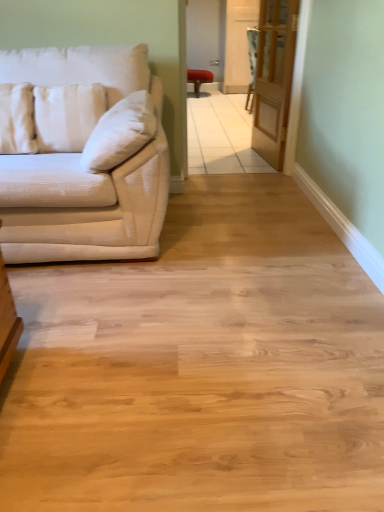
Question: Does velvet-like beige armchair at center have a smaller size compared to white fabric pillow at left, placed as the 1th pillow when sorted from left to right?

Choices:
 (A) no
 (B) yes

Answer: (A)

Question: From a real-world perspective, is velvet-like beige armchair at center beneath white fabric pillow at left, the 2th pillow when ordered from right to left?

Choices:
 (A) no
 (B) yes

Answer: (B)

Question: From a real-world perspective, is velvet-like beige armchair at center on white fabric pillow at left, placed as the 1th pillow when sorted from left to right?

Choices:
 (A) no
 (B) yes

Answer: (A)

Question: From the image's perspective, is velvet-like beige armchair at center located beneath white fabric pillow at left, the 2th pillow when ordered from right to left?

Choices:
 (A) yes
 (B) no

Answer: (B)

Question: Could you tell me if velvet-like beige armchair at center is facing white fabric pillow at left, the 2th pillow when ordered from right to left?

Choices:
 (A) no
 (B) yes

Answer: (A)

Question: From a real-world perspective, is white striped pillow at left, which is the second pillow in left-to-right order, physically located above or below velvet-like beige armchair at center?

Choices:
 (A) below
 (B) above

Answer: (B)

Question: Considering their positions, is white striped pillow at left, the 1th pillow from the right, located in front of or behind velvet-like beige armchair at center?

Choices:
 (A) front
 (B) behind

Answer: (A)

Question: Is white striped pillow at left, the 1th pillow from the right, to the left or to the right of velvet-like beige armchair at center in the image?

Choices:
 (A) right
 (B) left

Answer: (B)

Question: Looking at the image, does white striped pillow at left, which is the second pillow in left-to-right order, seem bigger or smaller compared to velvet-like beige armchair at center?

Choices:
 (A) big
 (B) small

Answer: (B)

Question: Is white fabric pillow at left, placed as the 1th pillow when sorted from left to right, situated inside matte white couch at left or outside?

Choices:
 (A) outside
 (B) inside

Answer: (B)

Question: Is point (13, 119) closer or farther from the camera than point (122, 67)?

Choices:
 (A) farther
 (B) closer

Answer: (B)

Question: From a real-world perspective, is white fabric pillow at left, the 2th pillow when ordered from right to left, physically located above or below matte white couch at left?

Choices:
 (A) above
 (B) below

Answer: (A)

Question: Visually, is white fabric pillow at left, the 2th pillow when ordered from right to left, positioned to the left or to the right of matte white couch at left?

Choices:
 (A) right
 (B) left

Answer: (B)

Question: Is matte red stool at center in front of or behind velvet-like beige armchair at center in the image?

Choices:
 (A) front
 (B) behind

Answer: (B)

Question: In terms of size, does matte red stool at center appear bigger or smaller than velvet-like beige armchair at center?

Choices:
 (A) big
 (B) small

Answer: (A)